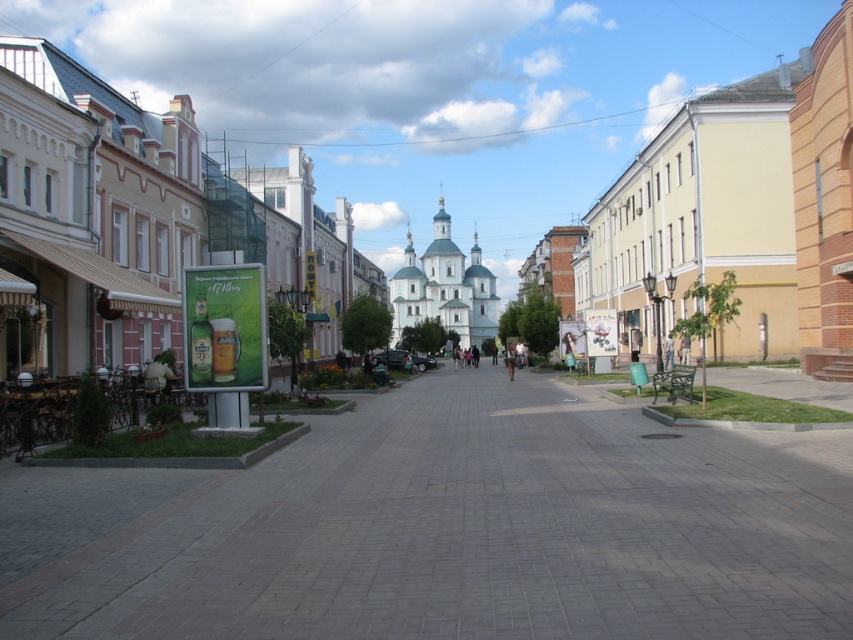
I want to click on brown leather jacket at center, so click(509, 358).

Is point (509, 346) closer to camera compared to point (492, 349)?

Yes, it is.

Is point (511, 369) positioned before point (494, 353)?

Yes, it is in front of point (494, 353).

Image resolution: width=853 pixels, height=640 pixels. I want to click on brown leather jacket at center, so click(509, 358).

Is point (670, 340) behind point (511, 358)?

Yes, point (670, 340) is behind point (511, 358).

The width and height of the screenshot is (853, 640). Find the location of `denim pants at center`. denim pants at center is located at coordinates (668, 353).

Image resolution: width=853 pixels, height=640 pixels. I want to click on denim pants at center, so pos(668,353).

Does white stone church at center have a greater width compared to dark blue jeans at center?

Yes.

Does point (556, 44) come farther from viewer compared to point (494, 353)?

Yes, it is.

Identify the location of white stone church at center. (430, 93).

Identify the location of white stone church at center. (430, 93).